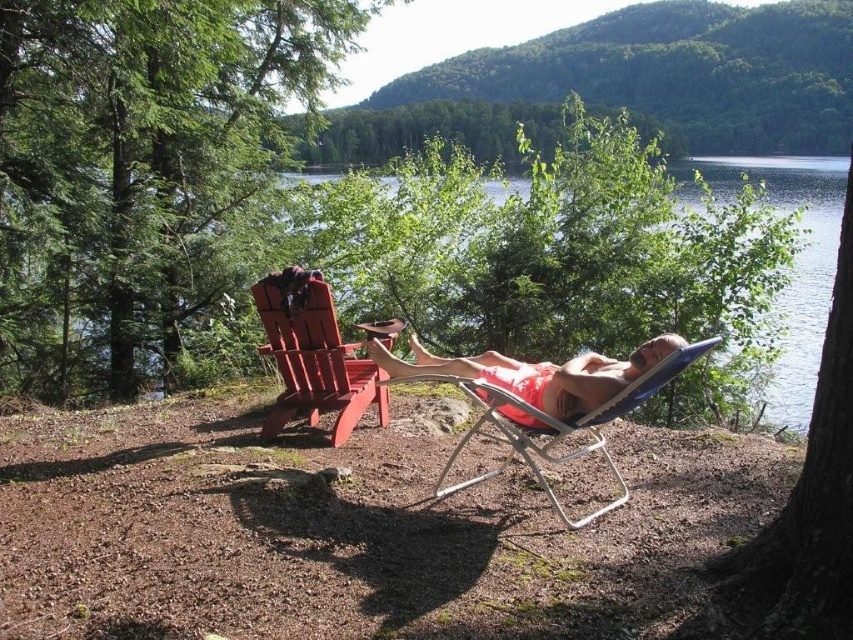
Looking at this image, can you confirm if green leafy tree at right is bigger than clear blue water at center?

Actually, green leafy tree at right might be smaller than clear blue water at center.

Is green leafy tree at right taller than clear blue water at center?

No, green leafy tree at right is not taller than clear blue water at center.

Which is in front, point (836, 429) or point (798, 326)?

Positioned in front is point (836, 429).

I want to click on green leafy tree at right, so click(x=804, y=508).

Consider the image. Who is more forward, (805, 580) or (463, 132)?

Point (805, 580)

Is green leafy tree at right smaller than green leafy tree at upper center?

Yes.

At what (x,y) coordinates should I click in order to perform the action: click on green leafy tree at right. Please return your answer as a coordinate pair (x, y). Looking at the image, I should click on (804, 508).

Does green leafy tree at upper center appear on the right side of smooth wood beach chair at left?

Indeed, green leafy tree at upper center is positioned on the right side of smooth wood beach chair at left.

Between green leafy tree at upper center and smooth wood beach chair at left, which one is positioned higher?

green leafy tree at upper center is higher up.

Does point (341, 125) come closer to viewer compared to point (318, 378)?

No, it is behind (318, 378).

What are the coordinates of `green leafy tree at upper center` in the screenshot? It's located at (430, 132).